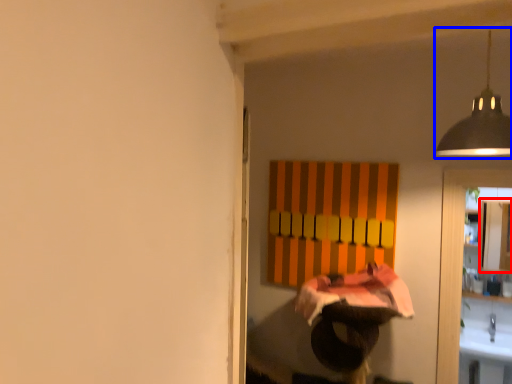
Question: Which object is further to the camera taking this photo, cabinetry (highlighted by a red box) or lamp (highlighted by a blue box)?

Choices:
 (A) cabinetry
 (B) lamp

Answer: (A)